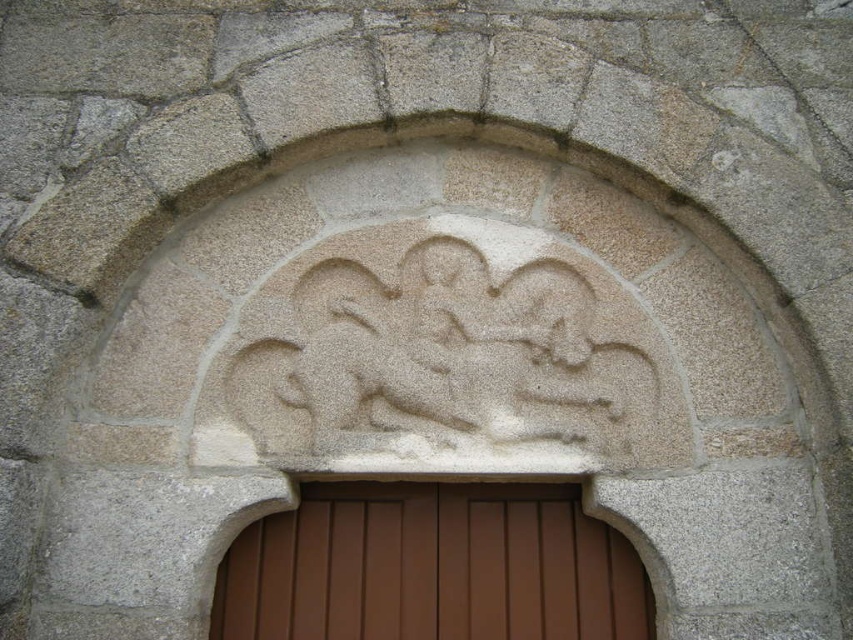
Between white stone carving at center and brown wooden door at center, which one has more height?

Standing taller between the two is white stone carving at center.

Is white stone carving at center closer to the viewer compared to brown wooden door at center?

Yes, it is.

Where is `white stone carving at center`? white stone carving at center is located at coordinates (450, 358).

The image size is (853, 640). Identify the location of white stone carving at center. (450, 358).